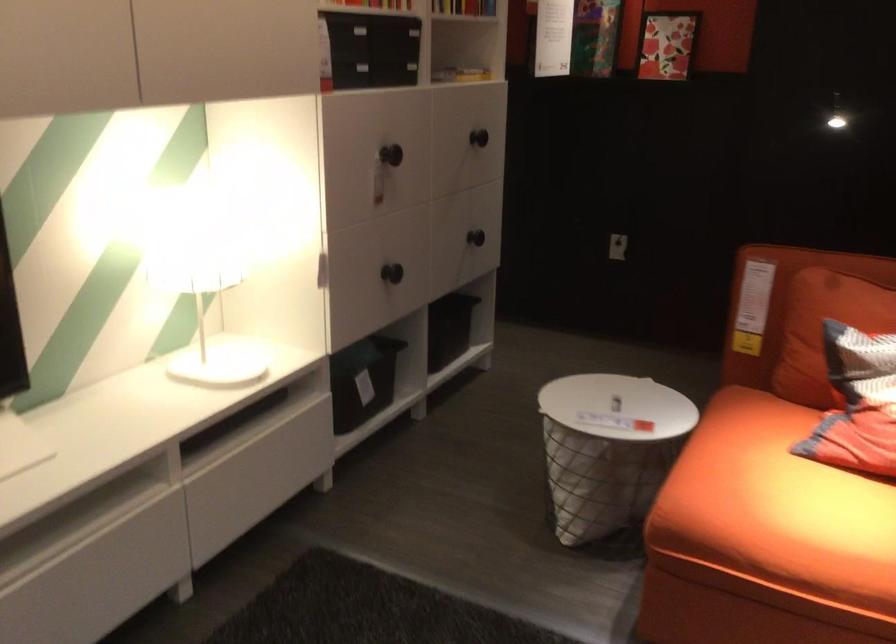
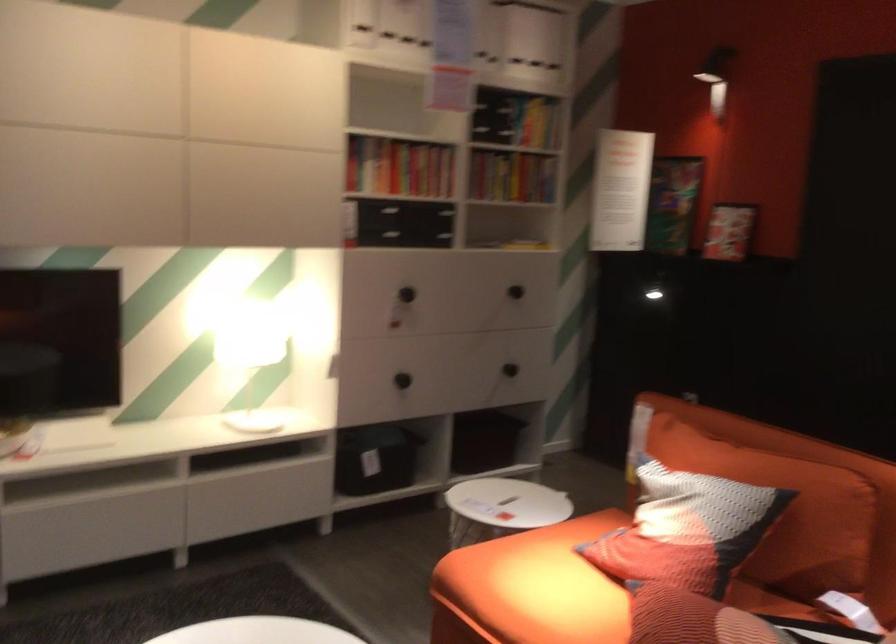
Find the pixel in the second image that matches (x=389, y=162) in the first image.

(407, 294)